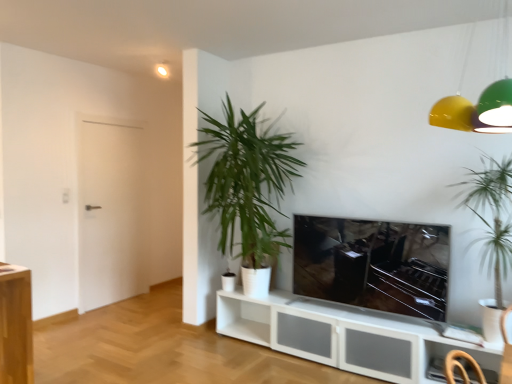
At what (x,y) coordinates should I click in order to perform the action: click on vacant space underneath green leafy plant at center, marked as the first houseplant in a back-to-front arrangement (from a real-world perspective). Please return your answer as a coordinate pair (x, y). The height and width of the screenshot is (384, 512). Looking at the image, I should click on (234, 350).